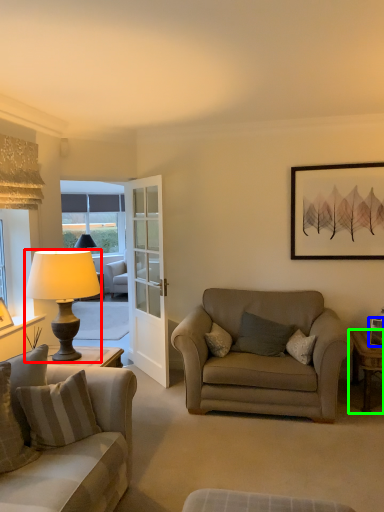
Question: Which object is the closest to the lamp (highlighted by a red box)? Choose among these: picture frame (highlighted by a blue box) or desk (highlighted by a green box).

Choices:
 (A) picture frame
 (B) desk

Answer: (B)